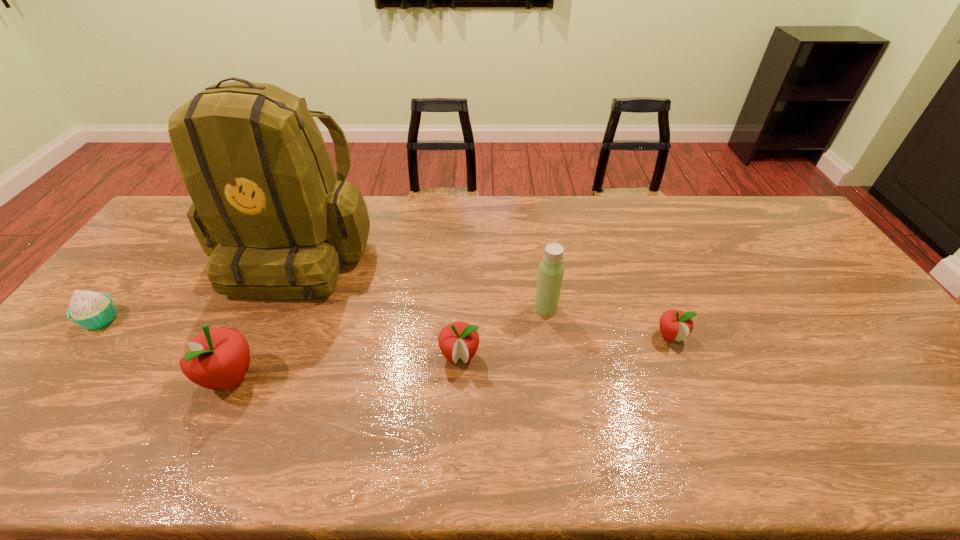
At what (x,y) coordinates should I click in order to perform the action: click on vacant point located on the left of the leftmost apple. Please return your answer as a coordinate pair (x, y). Looking at the image, I should click on (122, 377).

This screenshot has height=540, width=960. Find the location of `free space located on the back of the fourth object from left to right`. free space located on the back of the fourth object from left to right is located at coordinates (x=463, y=278).

Where is `vacant area located 0.150m on the left of the rightmost apple`? vacant area located 0.150m on the left of the rightmost apple is located at coordinates (600, 336).

Image resolution: width=960 pixels, height=540 pixels. Find the location of `vacant space situated on the front of the leftmost object`. vacant space situated on the front of the leftmost object is located at coordinates (26, 411).

You are a GUI agent. You are given a task and a screenshot of the screen. Output one action in this format:
    pyautogui.click(x=<x>, y=<y>)
    Task: Click on the blank space located on the front-facing side of the tallest object
    
    Given the screenshot: What is the action you would take?
    pyautogui.click(x=252, y=351)

Image resolution: width=960 pixels, height=540 pixels. Identify the location of vacant point located on the front of the second tallest object. (552, 348).

Find the location of a particular element. The height and width of the screenshot is (540, 960). object present at the far edge is located at coordinates (267, 209).

Find the location of `object present at the near edge`. object present at the near edge is located at coordinates (220, 357).

This screenshot has width=960, height=540. I want to click on object that is at the left edge, so click(x=91, y=310).

Find the location of a particular element. This screenshot has height=540, width=960. vacant space at the far edge of the desktop is located at coordinates (618, 220).